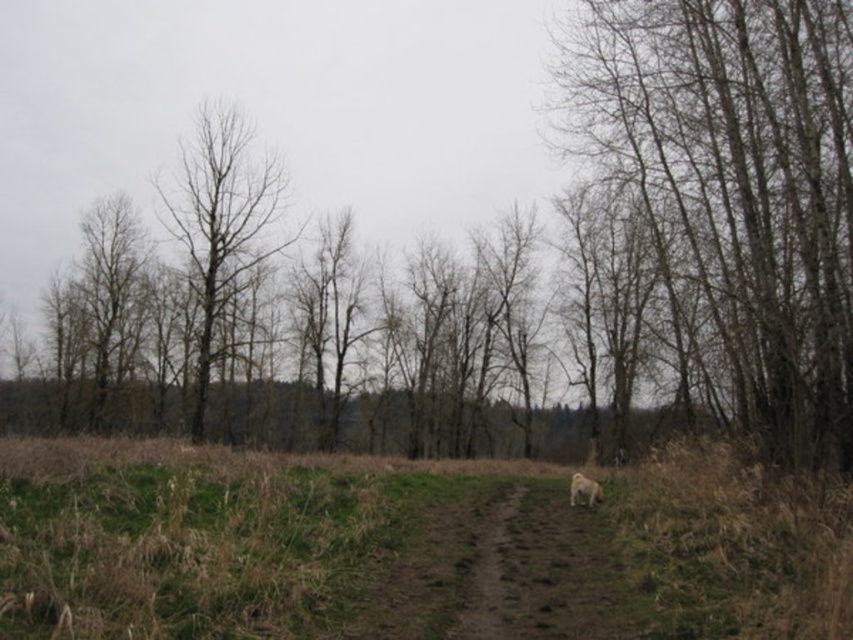
Looking at this image, which of these two, bare wood trees at right or brown dirt trail at center, stands taller?

bare wood trees at right

Is the position of bare wood trees at right more distant than that of brown dirt trail at center?

Yes, it is behind brown dirt trail at center.

Does point (583, 118) come in front of point (473, 566)?

That is False.

Locate an element on the screen. bare wood trees at right is located at coordinates (735, 188).

Can you confirm if green grass at lower center is positioned to the left of bare wood trees at right?

Correct, you'll find green grass at lower center to the left of bare wood trees at right.

Which is above, green grass at lower center or bare wood trees at right?

bare wood trees at right is above.

Between point (244, 474) and point (778, 168), which one is positioned in front?

Point (244, 474) is more forward.

Where is `green grass at lower center`? The image size is (853, 640). green grass at lower center is located at coordinates (410, 547).

Is bare wood trees at right further to the viewer compared to bare wood tree at left?

No, bare wood trees at right is closer to the viewer.

Is bare wood trees at right to the right of bare wood tree at left from the viewer's perspective?

Indeed, bare wood trees at right is positioned on the right side of bare wood tree at left.

Does point (834, 77) lie behind point (207, 376)?

That is False.

Where is `bare wood trees at right`? bare wood trees at right is located at coordinates (735, 188).